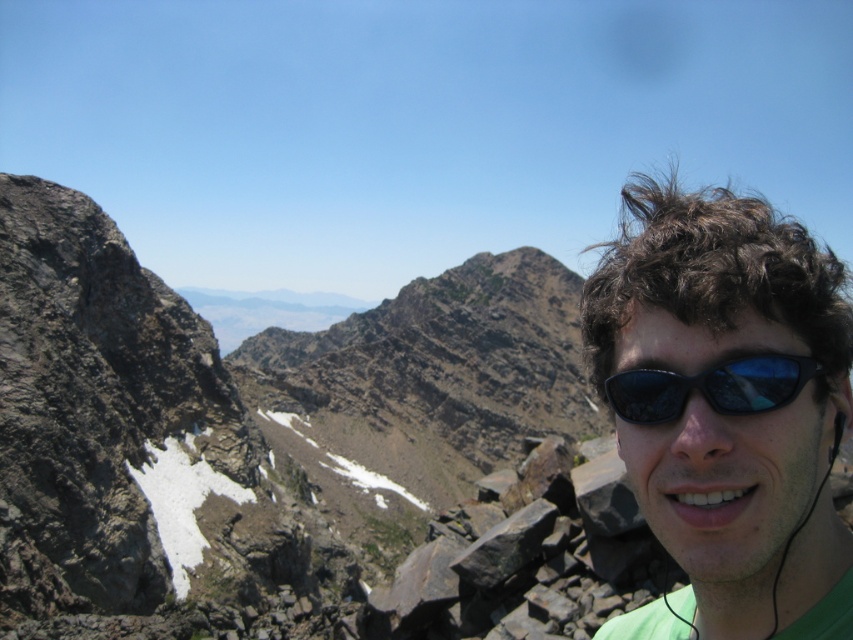
Question: Does brown rocky mountain at upper left have a smaller size compared to black reflective sunglasses at right?

Choices:
 (A) no
 (B) yes

Answer: (A)

Question: Which point appears closest to the camera in this image?

Choices:
 (A) (786, 364)
 (B) (289, 365)

Answer: (A)

Question: Is brown rocky mountain at upper left to the right of green matte sunglasses at upper right from the viewer's perspective?

Choices:
 (A) no
 (B) yes

Answer: (A)

Question: Based on their relative distances, which object is farther from the green matte sunglasses at upper right?

Choices:
 (A) black reflective sunglasses at right
 (B) brown rocky mountain at upper left

Answer: (B)

Question: Can you confirm if green matte sunglasses at upper right is positioned below black reflective sunglasses at right?

Choices:
 (A) yes
 (B) no

Answer: (A)

Question: Which of the following is the closest to the observer?

Choices:
 (A) black reflective sunglasses at right
 (B) green matte sunglasses at upper right

Answer: (B)